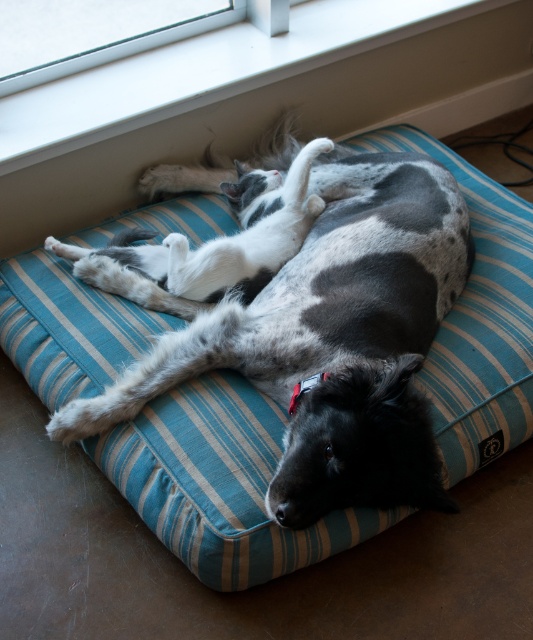
You are a small toy mouse. You want to roll from the spotted fur dog at center to the white smooth window sill at upper center. Can you reach the window sill from the dog without any obstacles?

The distance between the spotted fur dog at center and the white smooth window sill at upper center is 25.91 inches. Since you are a small toy mouse, you can easily roll that distance without any obstacles.

You are a photographer trying to capture a closeup of the spotted fur dog at center. The camera you are using has a focus point at position (333,340). Is the focus point correctly positioned to capture the dog?

Yes, the focus point at (333,340) is correctly positioned because the point marks the spotted fur dog at center.

You are a small toy that is 10 cm wide. You want to move from the spotted fur dog at center to the white smooth window sill at upper center. Can you fit through the space between them?

The spotted fur dog at center has a lesser width compared to white smooth window sill at upper center, so the space between them is sufficient for a 10 cm wide toy to pass through.